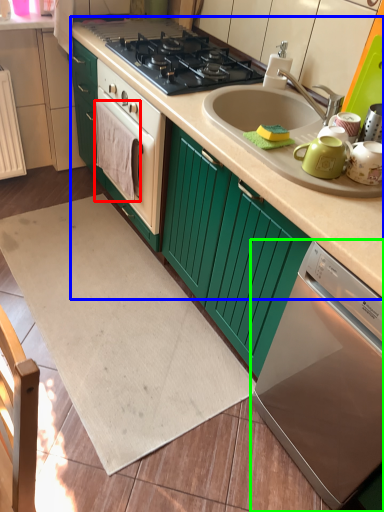
Question: Which object is the farthest from blanket (highlighted by a red box)? Choose among these: counter top (highlighted by a blue box) or home appliance (highlighted by a green box).

Choices:
 (A) counter top
 (B) home appliance

Answer: (B)